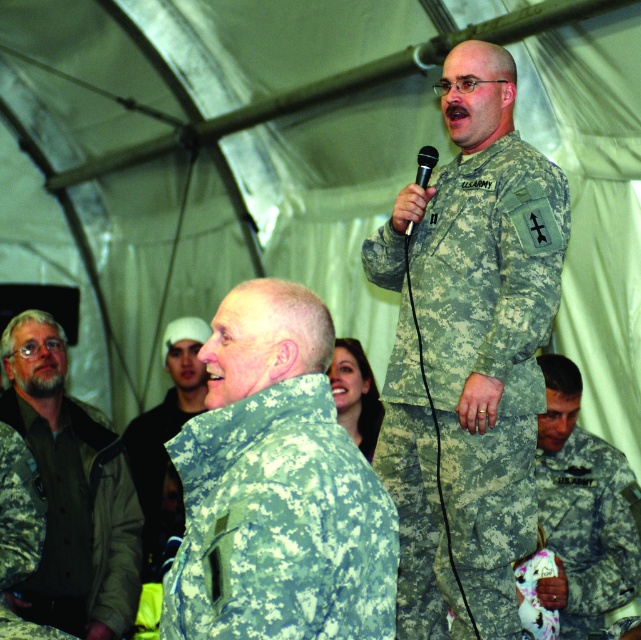
You are a photographer in the tent and want to capture a photo where both the camouflage uniform at lower right and the black plastic microphone at upper center are visible. Based on their positions, which object should you focus on first to ensure both are in frame?

The camouflage uniform at lower right is located below the black plastic microphone at upper center. To ensure both are in frame, focus on the black plastic microphone at upper center first since it is higher up, allowing the lower positioned camouflage uniform at lower right to still be captured within the photo.

You are a photographer at the event and need to capture a photo that includes both the camouflage uniform at lower right and the black plastic microphone at upper center. Which object should you focus on first to ensure both are in frame?

The camouflage uniform at lower right is taller than the black plastic microphone at upper center, so you should focus on the camouflage uniform at lower right first to ensure both are in frame.

You are standing in the tent and want to point to the exact location of point (488, 349). Which object in the scene is this point located on?

The point (488, 349) is located on the camouflage fabric uniform at upper center.